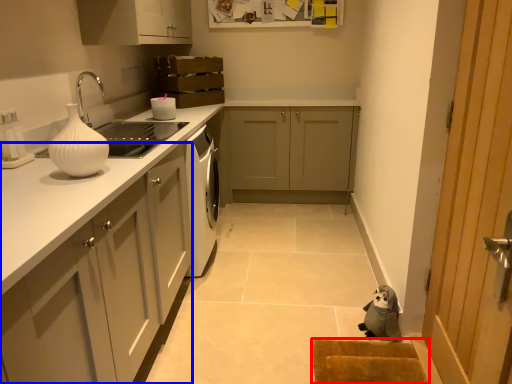
Question: Which object appears closest to the camera in this image, doormat (highlighted by a red box) or cabinetry (highlighted by a blue box)?

Choices:
 (A) doormat
 (B) cabinetry

Answer: (B)